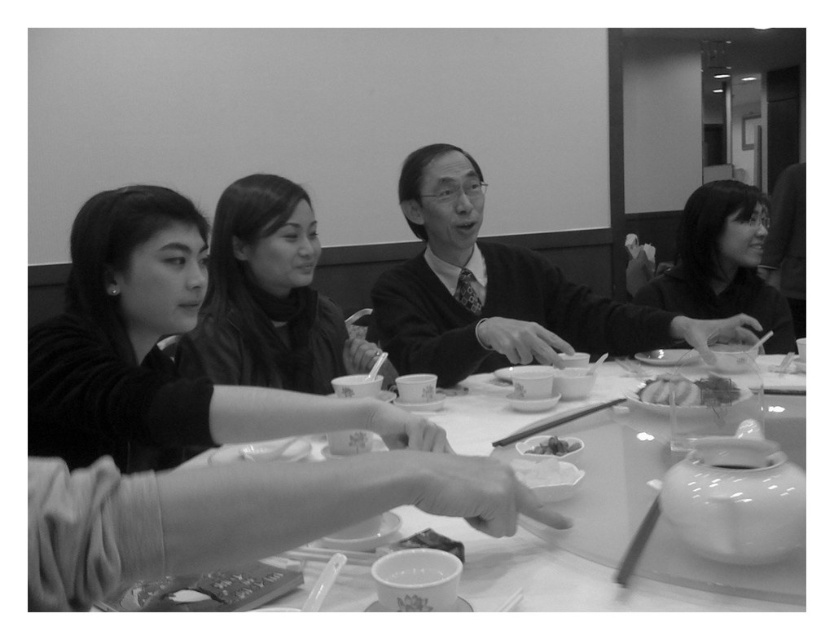
Between point (636, 563) and point (566, 444), which one is positioned in front?

Positioned in front is point (636, 563).

Does smooth plastic chopstick at lower center have a greater width compared to white porcelain bowl at center?

Correct, the width of smooth plastic chopstick at lower center exceeds that of white porcelain bowl at center.

Who is more distant from viewer, (637, 536) or (535, 448)?

Point (535, 448)

Find the location of a particular element. This screenshot has width=834, height=640. smooth plastic chopstick at lower center is located at coordinates (637, 545).

Consider the image. Who is lower down, smooth wooden chopsticks at center or white porcelain bowl at center?

Positioned lower is white porcelain bowl at center.

Does smooth wooden chopsticks at center come behind white porcelain bowl at center?

Yes, smooth wooden chopsticks at center is behind white porcelain bowl at center.

Locate an element on the screen. The height and width of the screenshot is (640, 834). smooth wooden chopsticks at center is located at coordinates (554, 422).

Where is `smooth wooden chopsticks at center`? The width and height of the screenshot is (834, 640). smooth wooden chopsticks at center is located at coordinates (554, 422).

Which of these two, smooth white rice at center or smooth wooden chopsticks at center, stands taller?

smooth wooden chopsticks at center is taller.

Where is `smooth white rice at center`? The image size is (834, 640). smooth white rice at center is located at coordinates (687, 390).